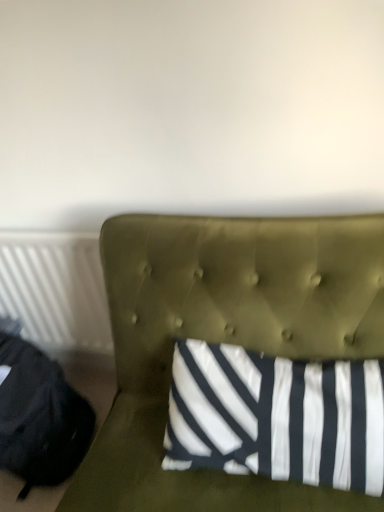
Question: From a real-world perspective, is black fabric bean bag chair at left located higher than white plastic radiator at left?

Choices:
 (A) yes
 (B) no

Answer: (B)

Question: Is black fabric bean bag chair at left not near white plastic radiator at left?

Choices:
 (A) no
 (B) yes

Answer: (A)

Question: Would you say white plastic radiator at left is part of black fabric bean bag chair at left's contents?

Choices:
 (A) no
 (B) yes

Answer: (A)

Question: Can you confirm if black fabric bean bag chair at left is shorter than white plastic radiator at left?

Choices:
 (A) no
 (B) yes

Answer: (B)

Question: From the image's perspective, is black fabric bean bag chair at left located beneath white plastic radiator at left?

Choices:
 (A) yes
 (B) no

Answer: (A)

Question: From a real-world perspective, is white plastic radiator at left physically located above or below black fabric bean bag chair at left?

Choices:
 (A) below
 (B) above

Answer: (B)

Question: Is white plastic radiator at left inside or outside of black fabric bean bag chair at left?

Choices:
 (A) outside
 (B) inside

Answer: (A)

Question: Is white plastic radiator at left to the left or to the right of black fabric bean bag chair at left in the image?

Choices:
 (A) left
 (B) right

Answer: (B)

Question: In the image, is white plastic radiator at left positioned in front of or behind black fabric bean bag chair at left?

Choices:
 (A) front
 (B) behind

Answer: (B)

Question: Relative to black fabric bean bag chair at left, is olive green tufted headboard at center in front or behind?

Choices:
 (A) front
 (B) behind

Answer: (A)

Question: Would you say olive green tufted headboard at center is to the left or to the right of black fabric bean bag chair at left in the picture?

Choices:
 (A) right
 (B) left

Answer: (A)

Question: From the image's perspective, is olive green tufted headboard at center positioned above or below black fabric bean bag chair at left?

Choices:
 (A) above
 (B) below

Answer: (A)

Question: Do you think olive green tufted headboard at center is within black fabric bean bag chair at left, or outside of it?

Choices:
 (A) inside
 (B) outside

Answer: (B)

Question: Is point (74, 423) closer or farther from the camera than point (211, 291)?

Choices:
 (A) farther
 (B) closer

Answer: (A)

Question: From the image's perspective, relative to olive green tufted headboard at center, is black fabric bean bag chair at left above or below?

Choices:
 (A) below
 (B) above

Answer: (A)